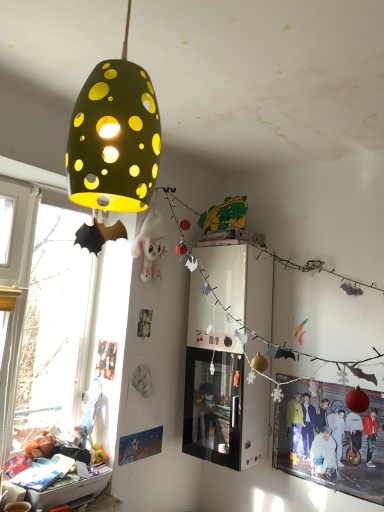
Question: Is matte green lampshade at upper left aimed at red glossy poster at lower right?

Choices:
 (A) yes
 (B) no

Answer: (B)

Question: Is matte green lampshade at upper left looking in the opposite direction of red glossy poster at lower right?

Choices:
 (A) no
 (B) yes

Answer: (A)

Question: Is matte green lampshade at upper left closer to the viewer compared to red glossy poster at lower right?

Choices:
 (A) yes
 (B) no

Answer: (A)

Question: Is matte green lampshade at upper left smaller than red glossy poster at lower right?

Choices:
 (A) no
 (B) yes

Answer: (A)

Question: Is matte green lampshade at upper left to the right of red glossy poster at lower right from the viewer's perspective?

Choices:
 (A) no
 (B) yes

Answer: (A)

Question: Can you confirm if matte green lampshade at upper left is wider than red glossy poster at lower right?

Choices:
 (A) no
 (B) yes

Answer: (B)

Question: Is matte black poster at lower left, the 1th poster page from the top, beside matte green lampshade at upper left?

Choices:
 (A) yes
 (B) no

Answer: (B)

Question: Is matte black poster at lower left, placed as the second poster page when sorted from bottom to top, not inside matte green lampshade at upper left?

Choices:
 (A) yes
 (B) no

Answer: (A)

Question: From the image's perspective, is matte black poster at lower left, which is the 2th poster page from right to left, on matte green lampshade at upper left?

Choices:
 (A) no
 (B) yes

Answer: (A)

Question: Is matte black poster at lower left, placed as the second poster page when sorted from bottom to top, wider than matte green lampshade at upper left?

Choices:
 (A) yes
 (B) no

Answer: (B)

Question: From a real-world perspective, is matte black poster at lower left, placed as the second poster page when sorted from bottom to top, located higher than matte green lampshade at upper left?

Choices:
 (A) no
 (B) yes

Answer: (A)

Question: Is matte black poster at lower left, the 1th poster page from the top, at the right side of matte green lampshade at upper left?

Choices:
 (A) no
 (B) yes

Answer: (A)

Question: Is matte black poster at lower left, which ranks as the first poster page in left-to-right order, oriented away from red glossy poster at lower right?

Choices:
 (A) yes
 (B) no

Answer: (B)